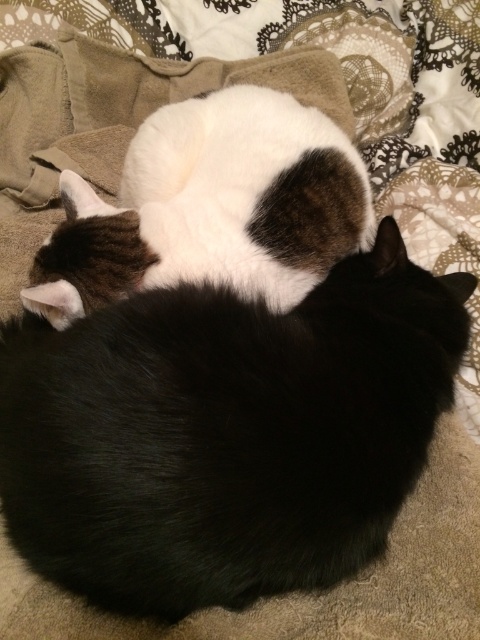
Question: Which point appears closest to the camera in this image?

Choices:
 (A) (x=242, y=400)
 (B) (x=337, y=230)

Answer: (A)

Question: Does black fur cat at center have a lesser width compared to white fur cat at center?

Choices:
 (A) yes
 (B) no

Answer: (B)

Question: Among these objects, which one is nearest to the camera?

Choices:
 (A) white fur cat at center
 (B) black fur cat at center

Answer: (B)

Question: Can you confirm if black fur cat at center is smaller than white fur cat at center?

Choices:
 (A) no
 (B) yes

Answer: (A)

Question: Among these objects, which one is nearest to the camera?

Choices:
 (A) white fur cat at center
 (B) black fur cat at center

Answer: (B)

Question: Does black fur cat at center have a greater width compared to white fur cat at center?

Choices:
 (A) no
 (B) yes

Answer: (B)